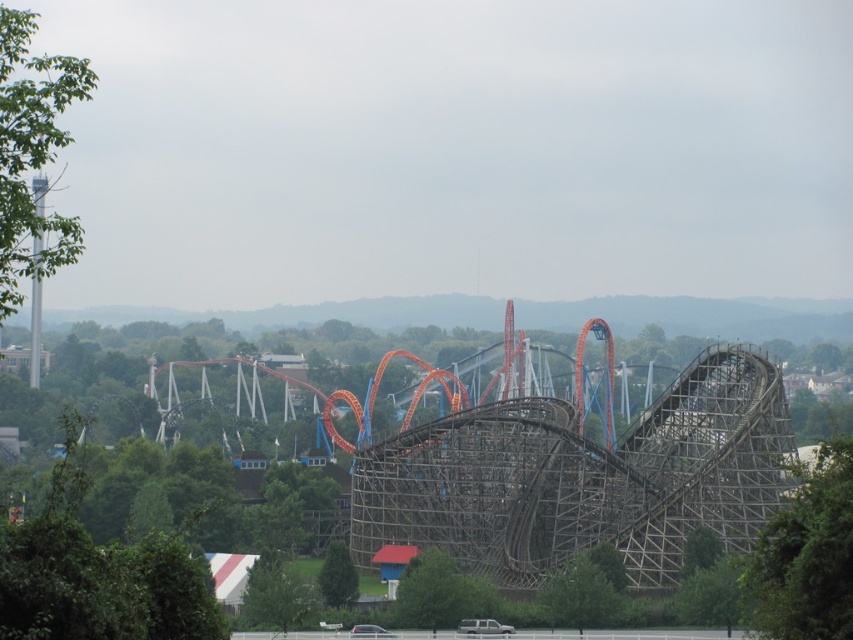
Question: Among these objects, which one is nearest to the camera?

Choices:
 (A) green leafy tree at lower center
 (B) green matte tree at center
 (C) green matte tree at lower center

Answer: (A)

Question: Can you confirm if green leafy tree at left is positioned below green leafy tree at lower center?

Choices:
 (A) yes
 (B) no

Answer: (B)

Question: Is green leafy tree at lower center to the right of green leafy tree at lower left from the viewer's perspective?

Choices:
 (A) no
 (B) yes

Answer: (B)

Question: Which object is the closest to the green leafy tree at lower center?

Choices:
 (A) green leafy tree at lower left
 (B) green matte tree at lower center
 (C) green leafy tree at left

Answer: (B)

Question: Among these points, which one is farthest from the camera?

Choices:
 (A) (344, 561)
 (B) (824, 579)

Answer: (A)

Question: Does green leafy tree at left appear over green matte tree at center?

Choices:
 (A) no
 (B) yes

Answer: (B)